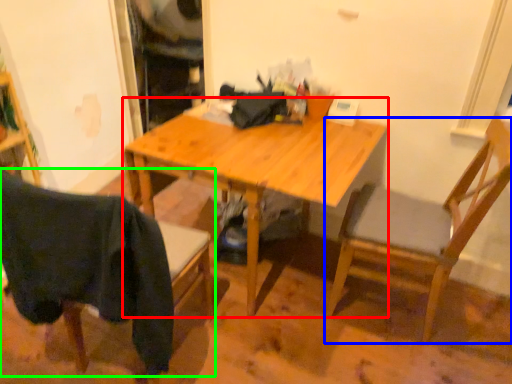
Question: Considering the real-world distances, which object is closest to desk (highlighted by a red box)? chair (highlighted by a blue box) or chair (highlighted by a green box).

Choices:
 (A) chair
 (B) chair

Answer: (A)